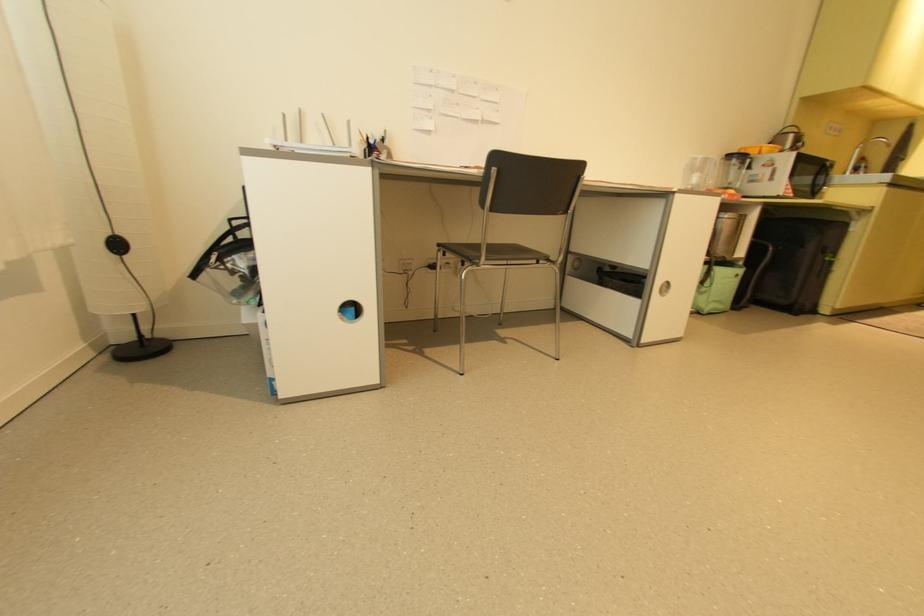
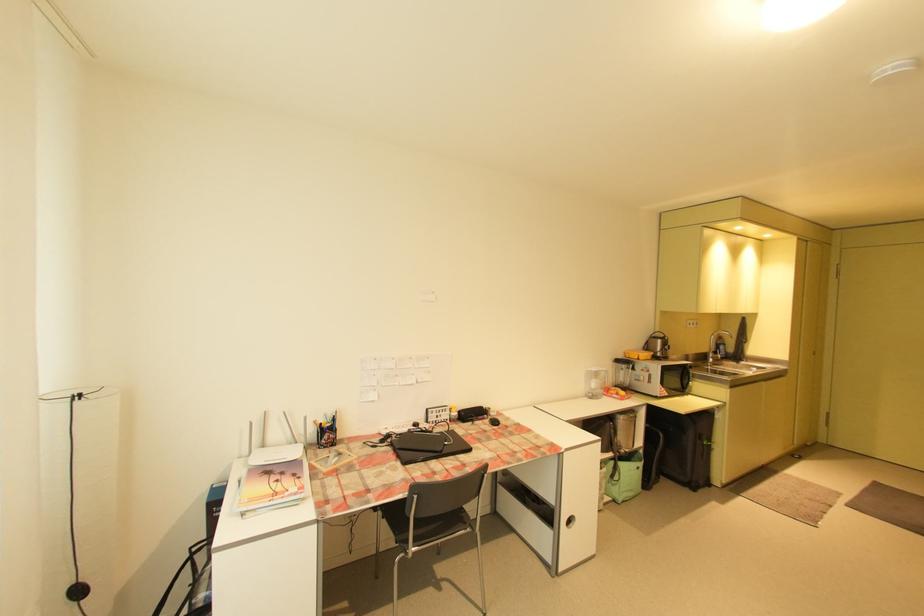
The point at (861, 171) is marked in the first image. Where is the corresponding point in the second image?

(722, 353)